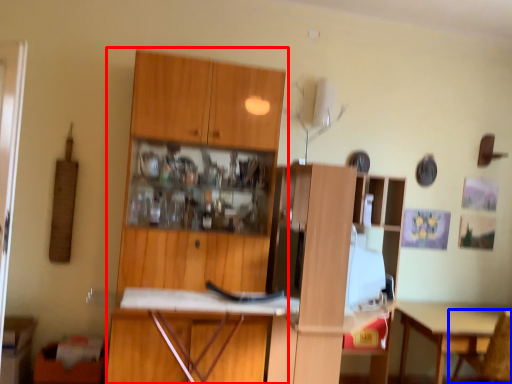
Question: Which object appears closest to the camera in this image, cabinetry (highlighted by a red box) or chair (highlighted by a blue box)?

Choices:
 (A) cabinetry
 (B) chair

Answer: (A)